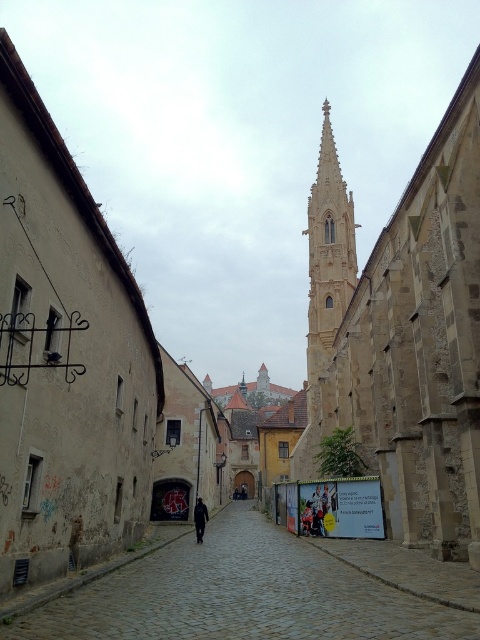
Question: Does yellow stone church at center appear under black matte jacket at center?

Choices:
 (A) no
 (B) yes

Answer: (A)

Question: Which object is the farthest from the light beige stone tower at center?

Choices:
 (A) yellow stone church at center
 (B) cobblestone alley at center

Answer: (B)

Question: Based on their relative distances, which object is nearer to the light beige stone tower at center?

Choices:
 (A) cobblestone alley at center
 (B) yellow stone church at center
 (C) black matte jacket at center
 (D) stone church at left

Answer: (B)

Question: Considering the relative positions of cobblestone alley at center and light beige stone tower at center in the image provided, where is cobblestone alley at center located with respect to light beige stone tower at center?

Choices:
 (A) below
 (B) above

Answer: (A)

Question: Does yellow stone church at center have a lesser width compared to light beige stone tower at center?

Choices:
 (A) no
 (B) yes

Answer: (A)

Question: Which point appears farthest from the camera in this image?

Choices:
 (A) (37, 282)
 (B) (199, 506)
 (C) (309, 310)
 (D) (431, 344)

Answer: (C)